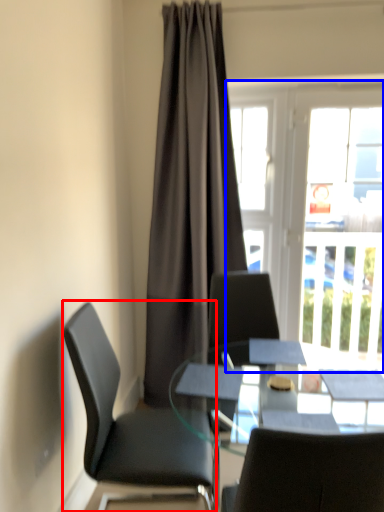
Question: Which object is closer to the camera taking this photo, chair (highlighted by a red box) or window (highlighted by a blue box)?

Choices:
 (A) chair
 (B) window

Answer: (A)